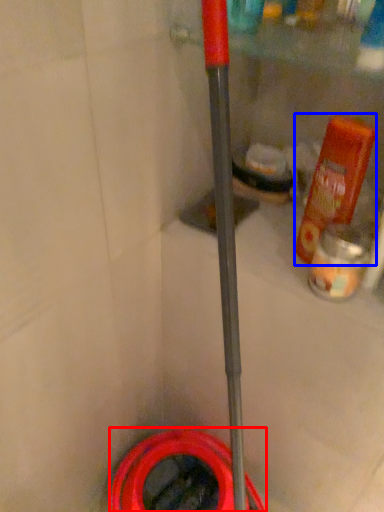
Question: Which point is closer to the camera, garden hose (highlighted by a red box) or bottle (highlighted by a blue box)?

Choices:
 (A) garden hose
 (B) bottle

Answer: (B)